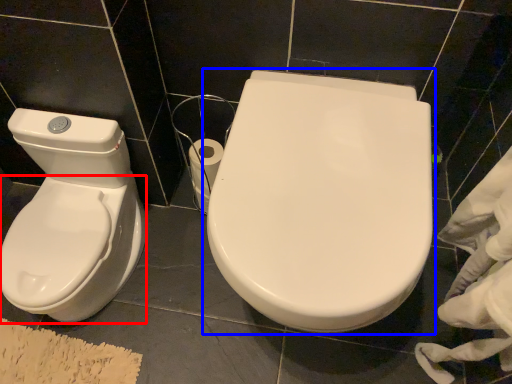
Question: Which of the following is the farthest to the observer, bidet (highlighted by a red box) or toilet (highlighted by a blue box)?

Choices:
 (A) bidet
 (B) toilet

Answer: (A)